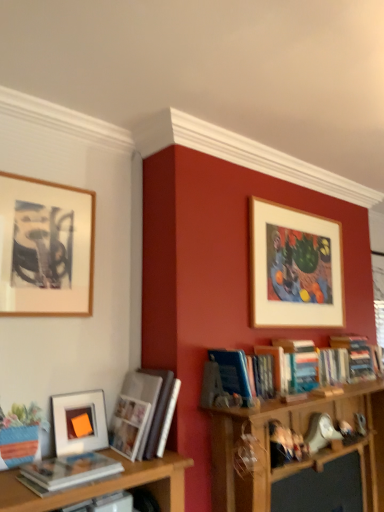
Question: Is white glossy photo album at left, placed as the 2th book when sorted from left to right, bigger than matte white book at lower left, which ranks as the fifth book in right-to-left order?

Choices:
 (A) yes
 (B) no

Answer: (A)

Question: Does white glossy photo album at left, placed as the 2th book when sorted from left to right, come in front of matte white book at lower left, the 1th book when ordered from left to right?

Choices:
 (A) yes
 (B) no

Answer: (B)

Question: From a real-world perspective, does white glossy photo album at left, placed as the 2th book when sorted from left to right, stand above matte white book at lower left, the 1th book when ordered from left to right?

Choices:
 (A) no
 (B) yes

Answer: (B)

Question: Are white glossy photo album at left, placed as the 2th book when sorted from left to right, and matte white book at lower left, which ranks as the fifth book in right-to-left order, making contact?

Choices:
 (A) no
 (B) yes

Answer: (A)

Question: From the image's perspective, is white glossy photo album at left, placed as the 2th book when sorted from left to right, over matte white book at lower left, the 1th book when ordered from left to right?

Choices:
 (A) no
 (B) yes

Answer: (B)

Question: Is matte white book at lower left, which ranks as the fifth book in right-to-left order, wider or thinner than wooden framed artwork at upper left, the 3th picture frame positioned from the right?

Choices:
 (A) wide
 (B) thin

Answer: (A)

Question: Considering the positions of point click(99, 465) and point click(18, 278), is point click(99, 465) closer or farther from the camera than point click(18, 278)?

Choices:
 (A) closer
 (B) farther

Answer: (A)

Question: Relative to wooden framed artwork at upper left, which is the third picture frame in back-to-front order, is matte white book at lower left, the 1th book when ordered from left to right, in front or behind?

Choices:
 (A) front
 (B) behind

Answer: (A)

Question: From the image's perspective, relative to wooden framed artwork at upper left, which is the third picture frame in back-to-front order, is matte white book at lower left, which ranks as the fifth book in right-to-left order, above or below?

Choices:
 (A) above
 (B) below

Answer: (B)

Question: Considering their positions, is blue hardcover book at center-right, the 3th book in the left-to-right sequence, located in front of or behind matte white picture frame at left, the second picture frame in the back-to-front sequence?

Choices:
 (A) front
 (B) behind

Answer: (B)

Question: From the image's perspective, is blue hardcover book at center-right, which is counted as the third book, starting from the right, located above or below matte white picture frame at left, the 2th picture frame in the right-to-left sequence?

Choices:
 (A) below
 (B) above

Answer: (B)

Question: Considering the positions of blue hardcover book at center-right, the 3th book in the left-to-right sequence, and matte white picture frame at left, the 2th picture frame from the left, in the image, is blue hardcover book at center-right, the 3th book in the left-to-right sequence, wider or thinner than matte white picture frame at left, the 2th picture frame from the left,?

Choices:
 (A) thin
 (B) wide

Answer: (B)

Question: Looking at the image, does blue hardcover book at center-right, the 3th book in the left-to-right sequence, seem bigger or smaller compared to matte white picture frame at left, the second picture frame in the back-to-front sequence?

Choices:
 (A) big
 (B) small

Answer: (A)

Question: From a real-world perspective, is hardcover books at upper right, which ranks as the 5th book in left-to-right order, above or below white glossy photo album at left, arranged as the 4th book when viewed from the right?

Choices:
 (A) above
 (B) below

Answer: (A)

Question: From the image's perspective, is hardcover books at upper right, which ranks as the 5th book in left-to-right order, above or below white glossy photo album at left, placed as the 2th book when sorted from left to right?

Choices:
 (A) above
 (B) below

Answer: (A)